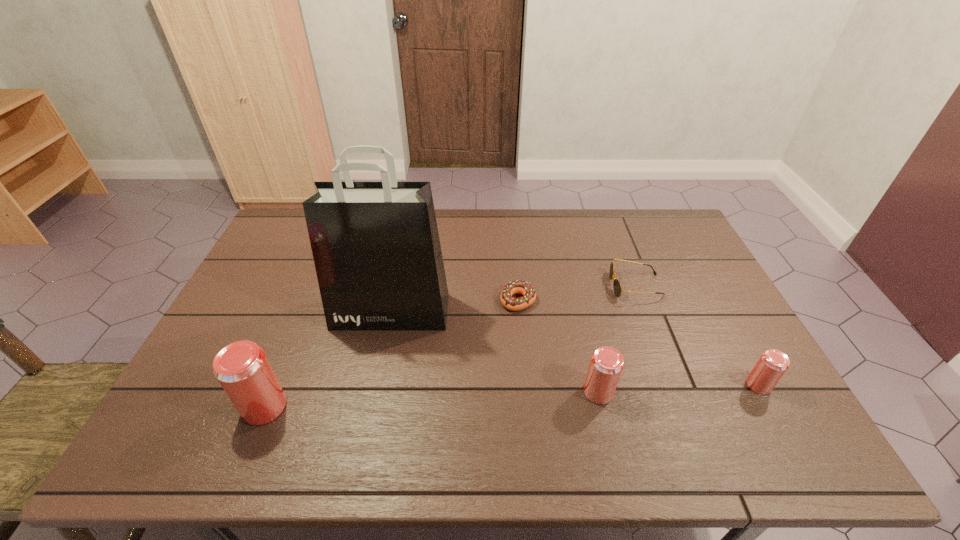
If equal spacing is the goal by inserting an additional beer_can among them, please point out a vacant space for this new beer_can. Please provide its 2D coordinates. Your answer should be formatted as a tuple, i.e. [(x, y)], where the tuple contains the x and y coordinates of a point satisfying the conditions above.

[(434, 399)]